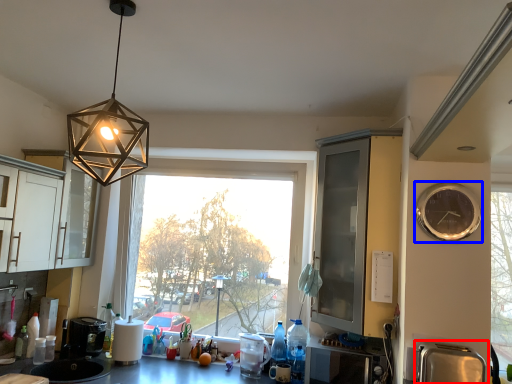
Question: Which object appears closest to the camera in this image, appliance (highlighted by a red box) or clock (highlighted by a blue box)?

Choices:
 (A) appliance
 (B) clock

Answer: (A)